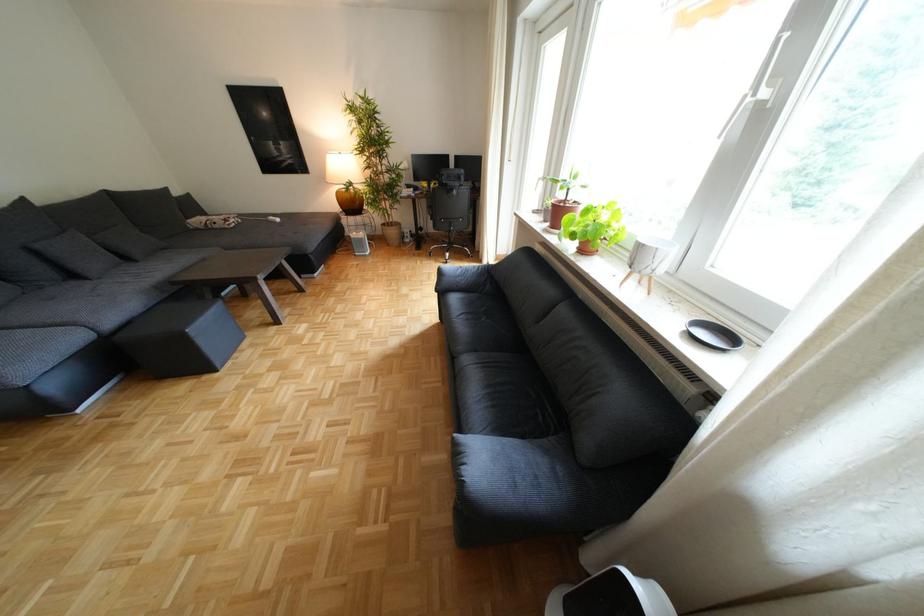
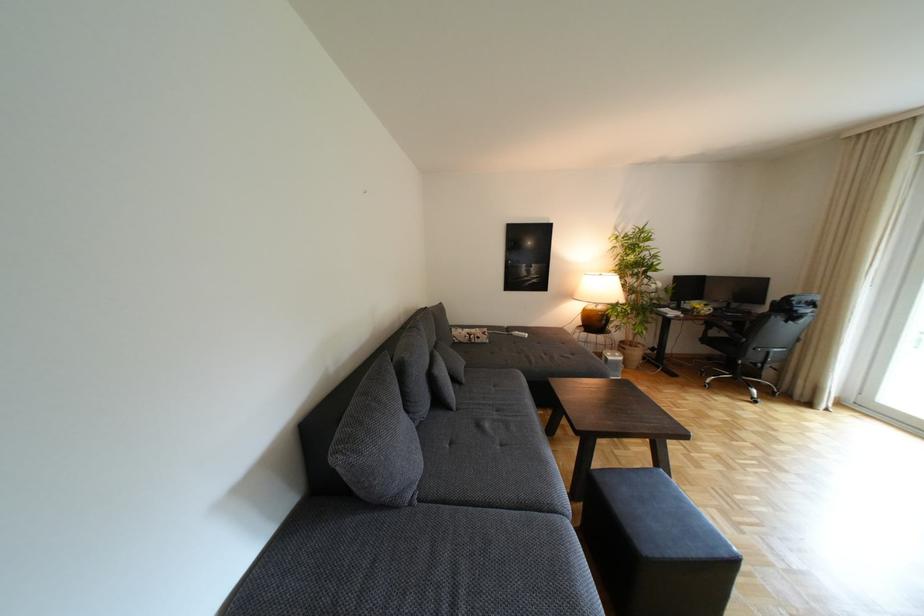
Question: What movement of the cameraman would produce the second image?

Choices:
 (A) Left
 (B) Right
 (C) Forward
 (D) Backward

Answer: (A)